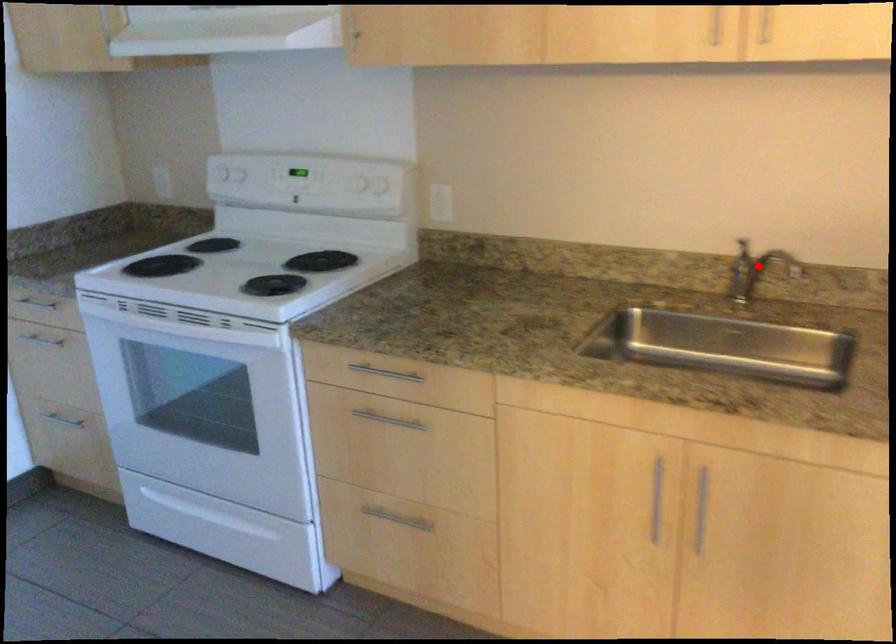
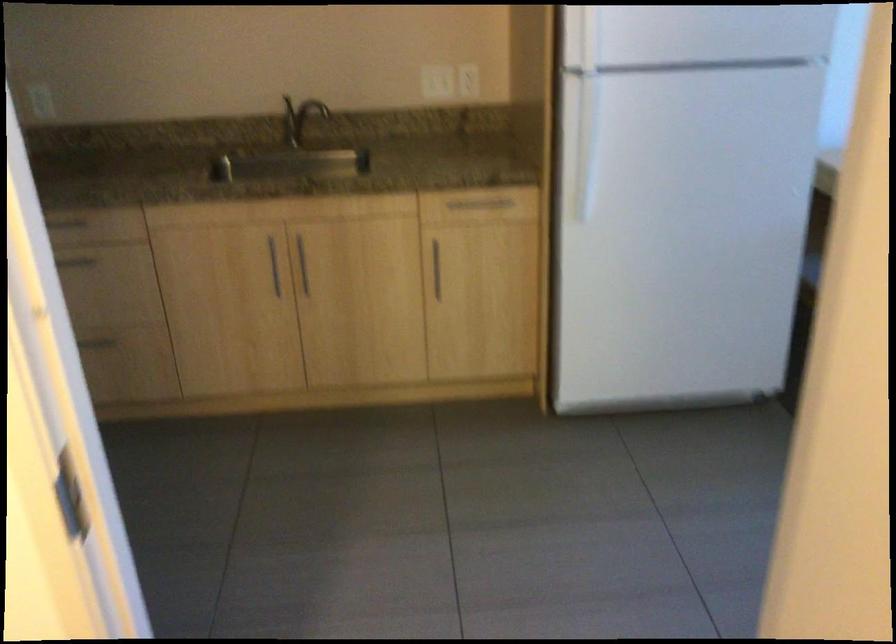
Question: A red point is marked in image1. In image2, is the corresponding 3D point closer to the camera or farther? Reply with the corresponding letter.

Choices:
 (A) The corresponding 3D point is closer.
 (B) The corresponding 3D point is farther.

Answer: (B)